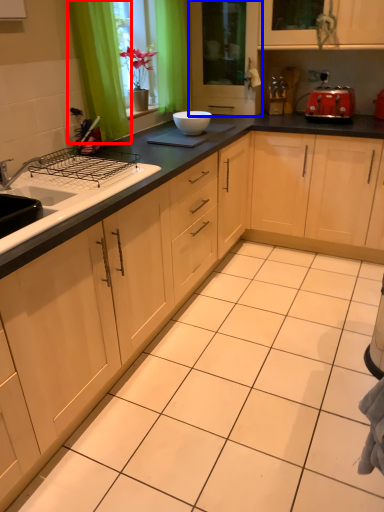
Question: Which of the following is the closest to the observer, curtain (highlighted by a red box) or screen door (highlighted by a blue box)?

Choices:
 (A) curtain
 (B) screen door

Answer: (A)